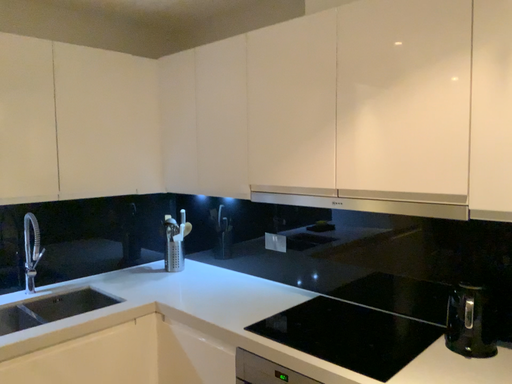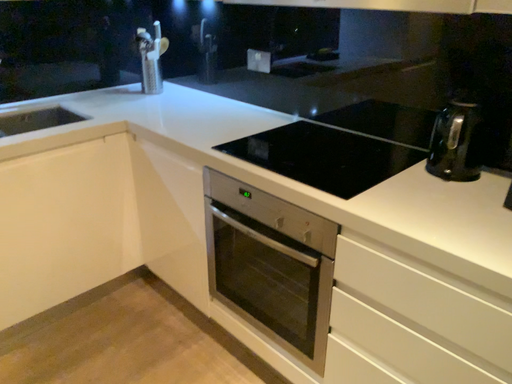
Question: Which way did the camera rotate in the video?

Choices:
 (A) rotated upward
 (B) rotated downward

Answer: (B)